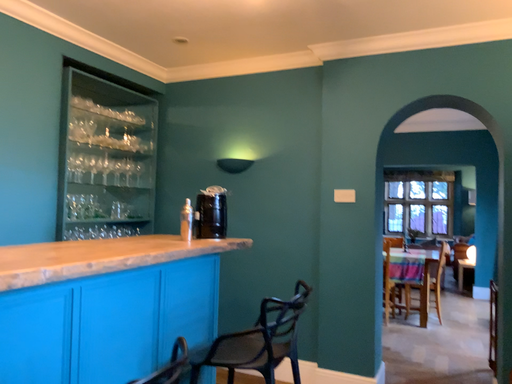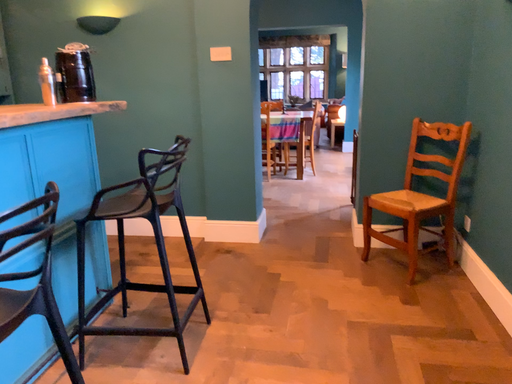
Question: How did the camera likely rotate when shooting the video?

Choices:
 (A) rotated upward
 (B) rotated downward

Answer: (B)